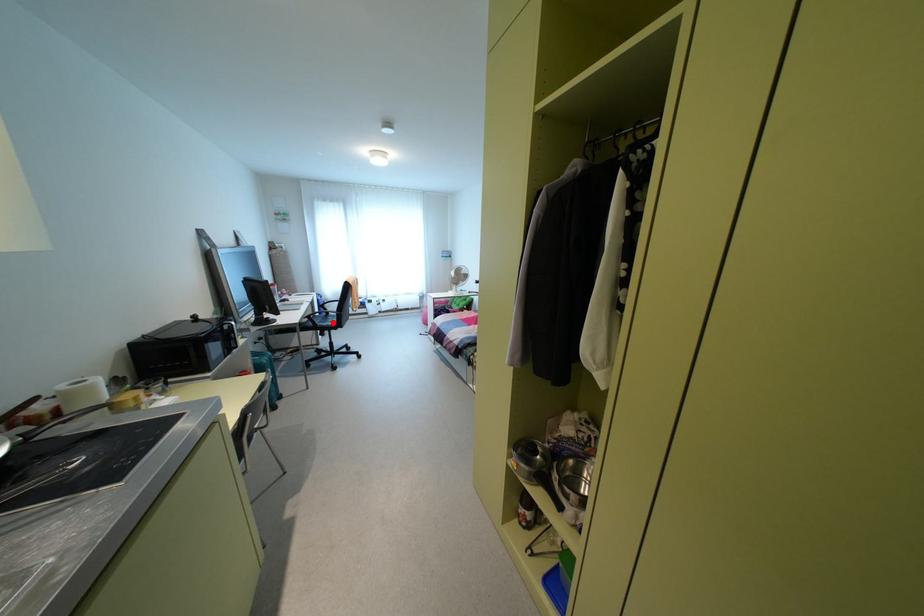
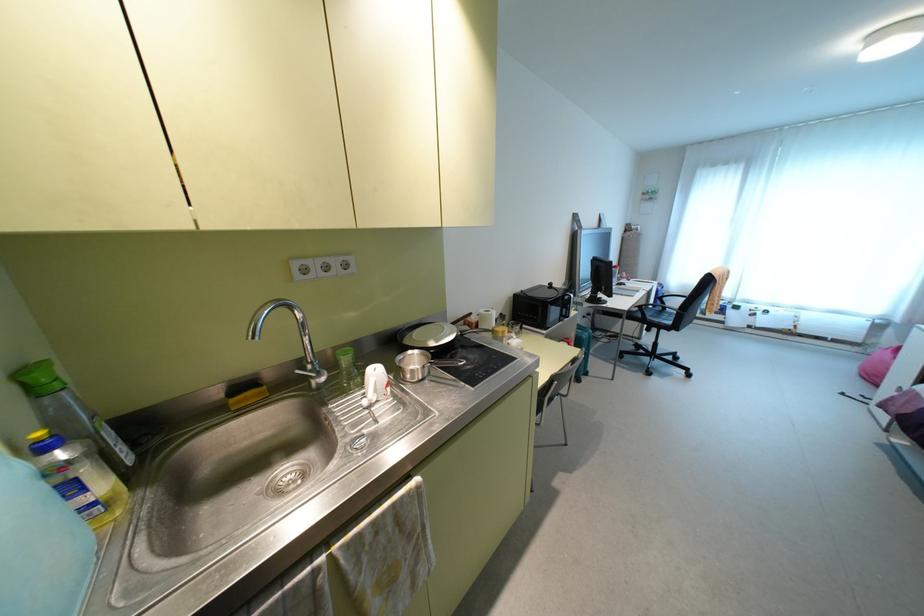
Question: I am providing you with two images of the same scene from different viewpoints. In image1, a red point is highlighted. Considering the same 3D point in image2, which of the following is correct?

Choices:
 (A) It is closer
 (B) It is farther

Answer: (B)